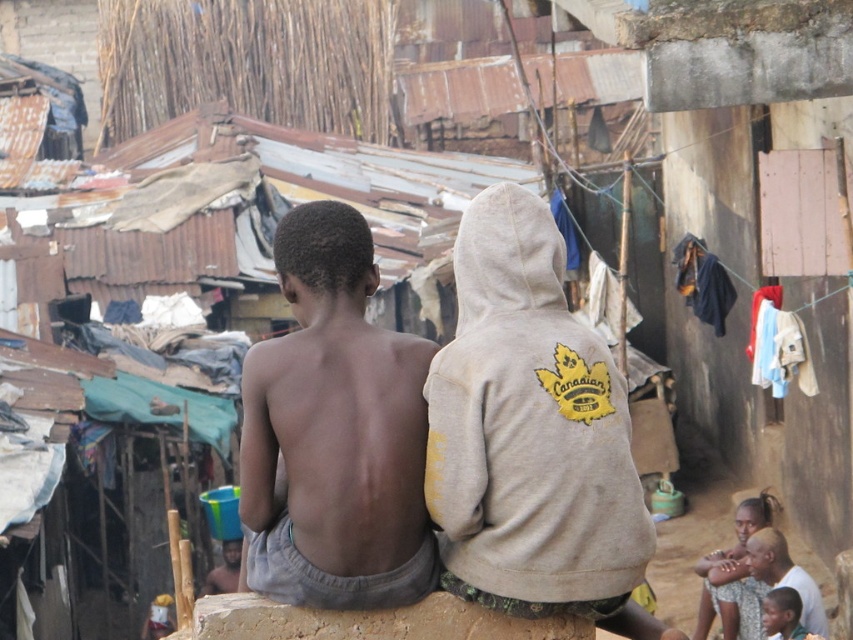
Between point (352, 625) and point (718, 589), which one is positioned behind?

The point (718, 589) is more distant.

Who is positioned more to the left, brown rough stone at lower center or light brown skin at center?

brown rough stone at lower center

Identify the location of brown rough stone at lower center. The image size is (853, 640). (370, 621).

Identify the location of brown rough stone at lower center. This screenshot has width=853, height=640. (370, 621).

Is light beige hoodie at center further to camera compared to dark skin/smooth skin/man at center?

No, light beige hoodie at center is in front of dark skin/smooth skin/man at center.

Measure the distance between light beige hoodie at center and dark skin/smooth skin/man at center.

They are 18.40 inches apart.

Which is in front, point (599, 477) or point (260, 538)?

Point (599, 477)

The image size is (853, 640). I want to click on light beige hoodie at center, so click(x=531, y=435).

Does dark skin/smooth skin/man at center come behind light brown skin at center?

No, dark skin/smooth skin/man at center is in front of light brown skin at center.

Does point (350, 449) lie in front of point (730, 573)?

That is True.

Locate an element on the screen. This screenshot has height=640, width=853. dark skin/smooth skin/man at center is located at coordinates (334, 433).